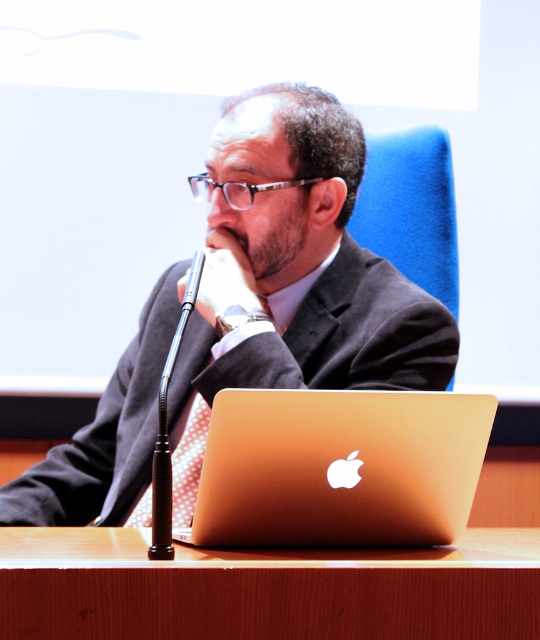
Can you confirm if matte black suit at center is taller than gold metallic laptop at center?

Yes.

Does matte black suit at center come in front of gold metallic laptop at center?

That is False.

The width and height of the screenshot is (540, 640). Identify the location of matte black suit at center. (293, 273).

The image size is (540, 640). In order to click on matte black suit at center in this screenshot , I will do `click(293, 273)`.

Which of these two, gold metallic laptop at center or red dotted tie at center, stands taller?

red dotted tie at center is taller.

Is gold metallic laptop at center positioned before red dotted tie at center?

Yes, it is in front of red dotted tie at center.

Does point (388, 394) come behind point (185, 452)?

No.

The height and width of the screenshot is (640, 540). Find the location of `gold metallic laptop at center`. gold metallic laptop at center is located at coordinates (339, 467).

Who is more distant from viewer, (148, 593) or (205, 419)?

Point (205, 419)

Is point (118, 554) positioned in front of point (139, 506)?

That is True.

The height and width of the screenshot is (640, 540). In order to click on wooden table at center in this screenshot , I will do `click(266, 588)`.